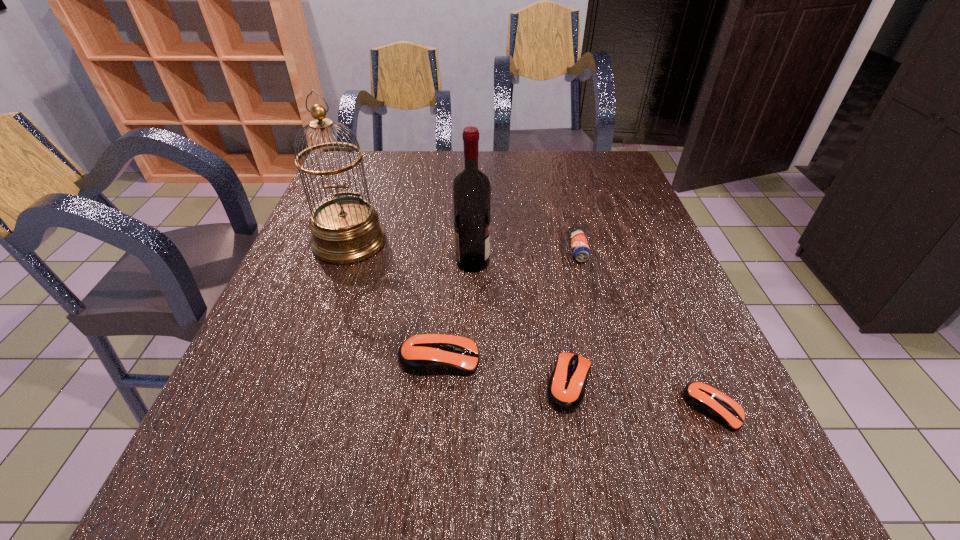
Identify the location of the third closest object to the alcohol. (425, 354).

Find the location of `the second closest computer mouse to the leftmost computer mouse`. the second closest computer mouse to the leftmost computer mouse is located at coordinates [705, 399].

Locate which computer mouse is the second closest to the third object from right to left. Please provide its 2D coordinates. Your answer should be formatted as a tuple, i.e. [(x, y)], where the tuple contains the x and y coordinates of a point satisfying the conditions above.

[(705, 399)]

The width and height of the screenshot is (960, 540). Find the location of `vacant area in the image that satisfies the following two spatial constraints: 1. with an open door on the birdcage; 2. on the right side of the beer can`. vacant area in the image that satisfies the following two spatial constraints: 1. with an open door on the birdcage; 2. on the right side of the beer can is located at coordinates (347, 250).

Where is `free space that satisfies the following two spatial constraints: 1. on the front and back of the second shortest object; 2. on the left side of the alcohol`? free space that satisfies the following two spatial constraints: 1. on the front and back of the second shortest object; 2. on the left side of the alcohol is located at coordinates (470, 383).

This screenshot has height=540, width=960. I want to click on free space in the image that satisfies the following two spatial constraints: 1. on the back side of the second object from right to left; 2. on the right side of the third object from right to left, so click(x=546, y=250).

I want to click on vacant space that satisfies the following two spatial constraints: 1. with an open door on the shortest object; 2. on the right side of the leftmost object, so click(x=290, y=409).

At what (x,y) coordinates should I click in order to perform the action: click on vacant position in the image that satisfies the following two spatial constraints: 1. with an open door on the tallest computer mouse; 2. on the left side of the birdcage. Please return your answer as a coordinate pair (x, y). Looking at the image, I should click on (307, 359).

Locate an element on the screen. vacant point that satisfies the following two spatial constraints: 1. on the front and back of the alcohol; 2. on the back side of the rightmost object is located at coordinates (469, 409).

This screenshot has width=960, height=540. I want to click on vacant area that satisfies the following two spatial constraints: 1. on the front side of the rightmost computer mouse; 2. on the left side of the beer can, so click(619, 409).